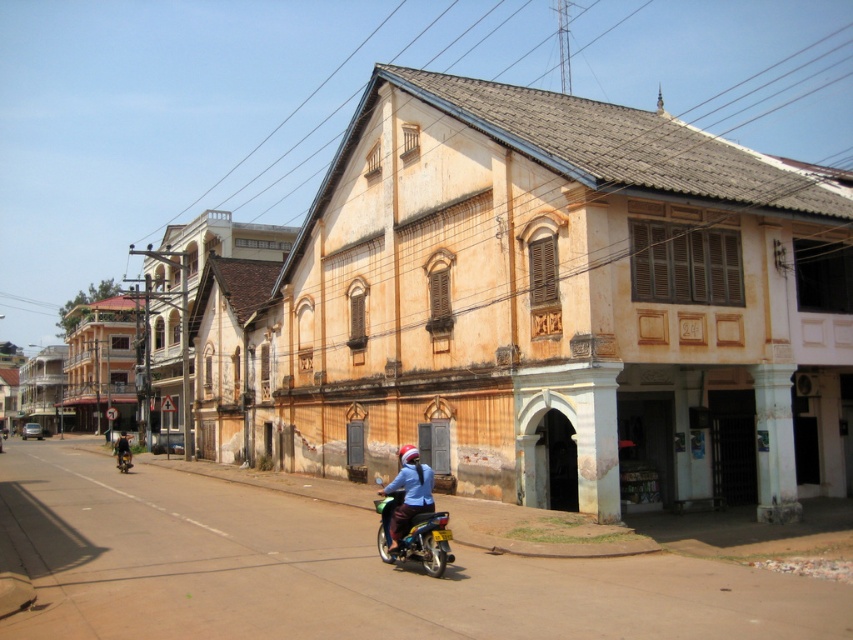
Question: Which object appears farthest from the camera in this image?

Choices:
 (A) beige textured building at center
 (B) dark blue fabric jacket at left
 (C) blue fabric santa hat at center

Answer: (B)

Question: Does beige textured building at center appear under metallic blue motorcycle at lower center?

Choices:
 (A) no
 (B) yes

Answer: (A)

Question: Is metallic blue motorcycle at lower center above dark blue fabric jacket at left?

Choices:
 (A) yes
 (B) no

Answer: (A)

Question: Estimate the real-world distances between objects in this image. Which object is farther from the beige textured building at center?

Choices:
 (A) metallic blue motorcycle at lower center
 (B) dark blue fabric jacket at left

Answer: (A)

Question: Can you confirm if beige textured building at center is wider than dark blue fabric jacket at left?

Choices:
 (A) no
 (B) yes

Answer: (B)

Question: Considering the real-world distances, which object is closest to the beige textured building at center?

Choices:
 (A) blue fabric santa hat at center
 (B) metallic blue motorcycle at lower center

Answer: (A)